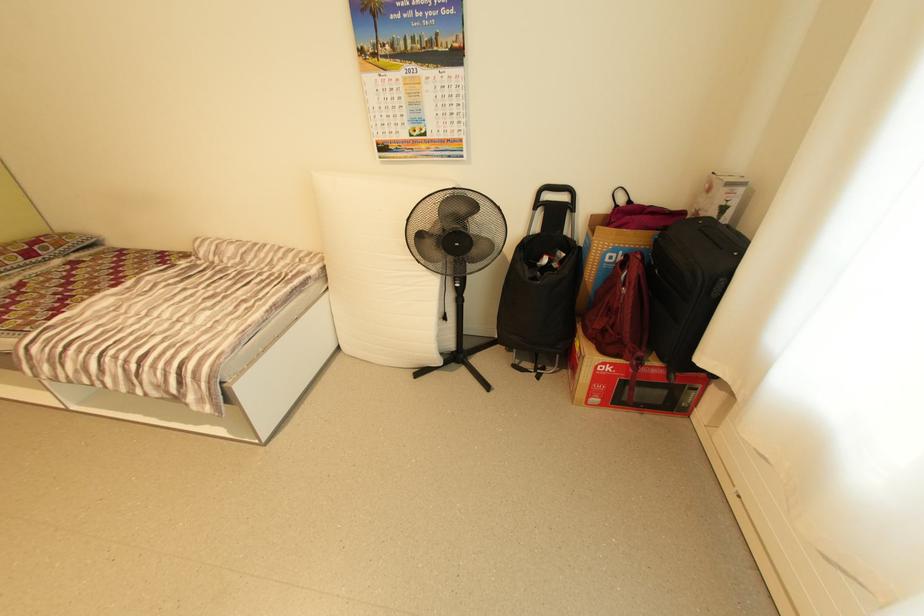
The width and height of the screenshot is (924, 616). I want to click on black suitcase handle, so click(718, 235).